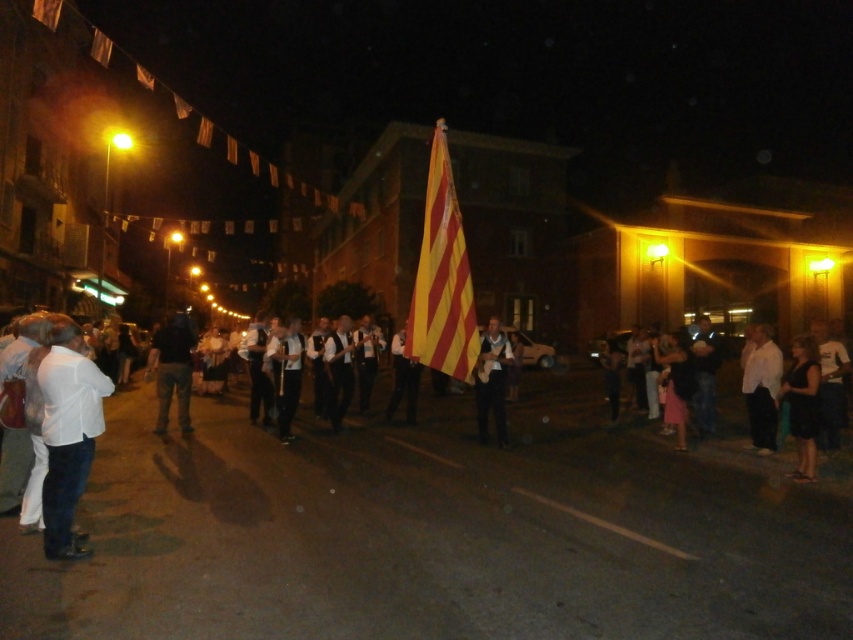
Is white cotton shirt at center to the left of yellow striped fabric at center from the viewer's perspective?

Incorrect, white cotton shirt at center is not on the left side of yellow striped fabric at center.

Who is higher up, white cotton shirt at center or yellow striped fabric at center?

yellow striped fabric at center is higher up.

Describe the element at coordinates (492, 381) in the screenshot. I see `white cotton shirt at center` at that location.

Image resolution: width=853 pixels, height=640 pixels. I want to click on white cotton shirt at center, so click(x=492, y=381).

Who is more forward, (749, 362) or (321, 380)?

Positioned in front is point (749, 362).

Find the location of a particular element. The height and width of the screenshot is (640, 853). white matte shirt at right is located at coordinates (762, 388).

This screenshot has height=640, width=853. Describe the element at coordinates (762, 388) in the screenshot. I see `white matte shirt at right` at that location.

The height and width of the screenshot is (640, 853). I want to click on white matte shirt at right, so click(762, 388).

Can you confirm if dark blue jeans at center is taller than black fabric dress at lower right?

Yes, dark blue jeans at center is taller than black fabric dress at lower right.

Can you confirm if dark blue jeans at center is shorter than black fabric dress at lower right?

No, dark blue jeans at center is not shorter than black fabric dress at lower right.

Between point (178, 346) and point (798, 461), which one is positioned in front?

Point (798, 461)

Locate an element on the screen. Image resolution: width=853 pixels, height=640 pixels. dark blue jeans at center is located at coordinates (172, 369).